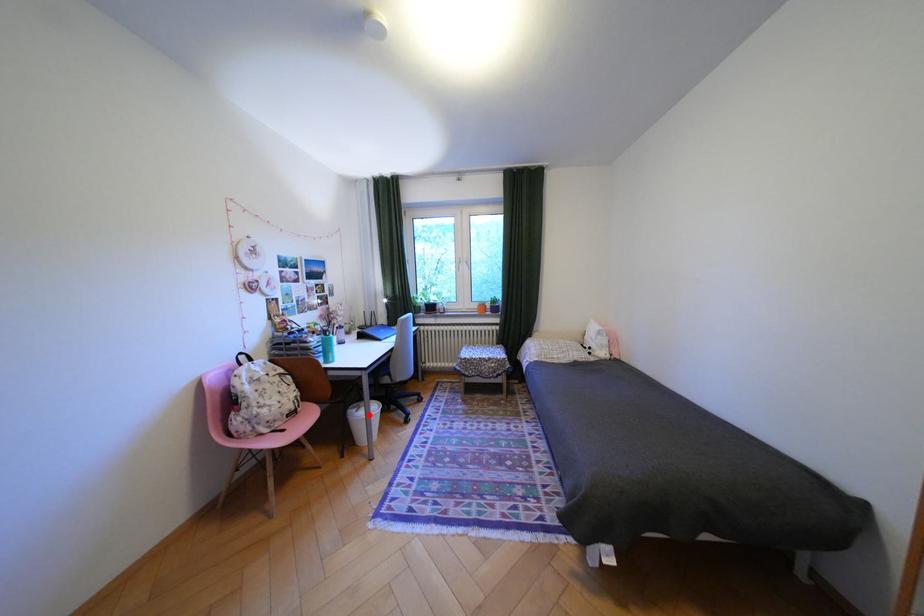
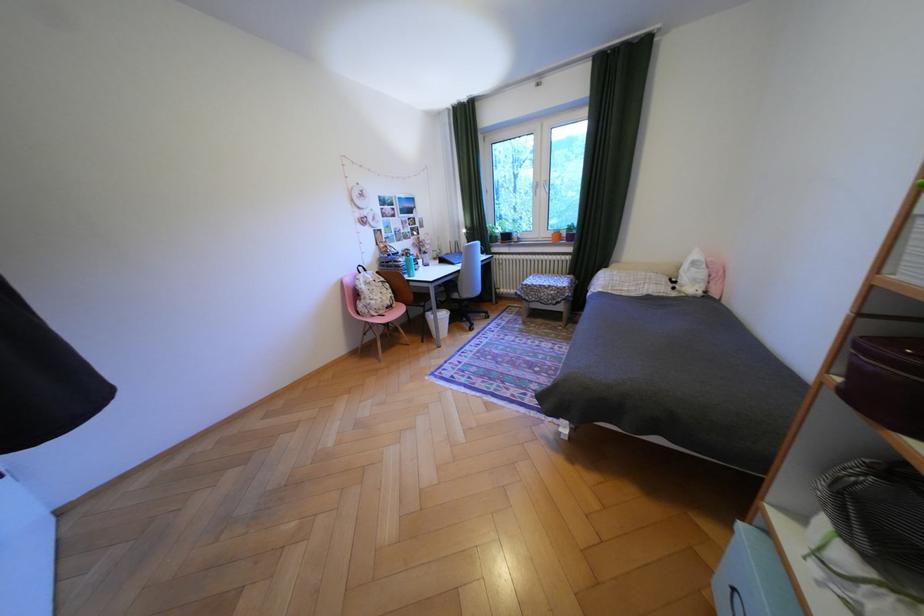
The point at the highlighted location is marked in the first image. Where is the corresponding point in the second image?

(442, 315)